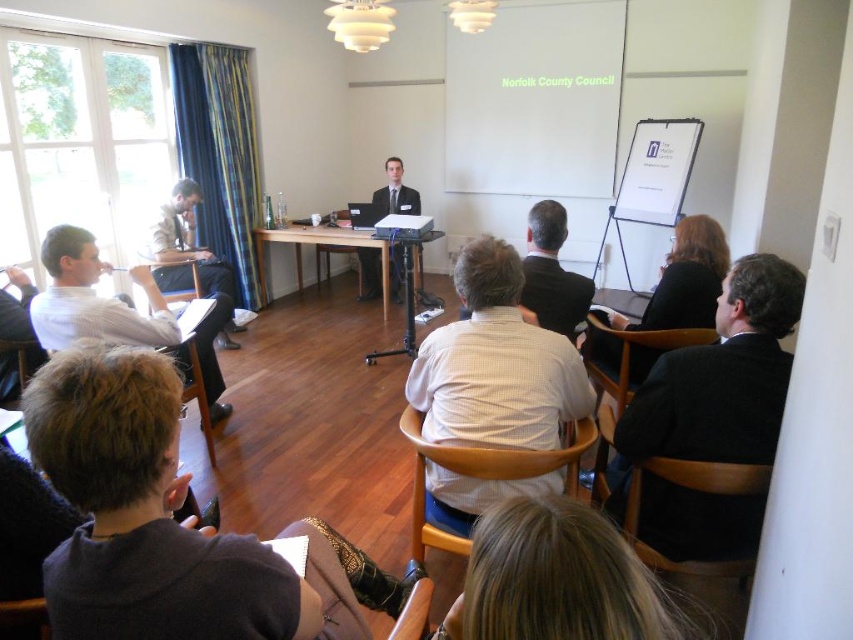
Question: Does white shirt at left have a greater width compared to light brown leather jacket at left?

Choices:
 (A) yes
 (B) no

Answer: (B)

Question: Is black suit at right to the right of light brown wood table at center from the viewer's perspective?

Choices:
 (A) yes
 (B) no

Answer: (A)

Question: Which point appears farthest from the camera in this image?

Choices:
 (A) (728, 401)
 (B) (376, 276)
 (C) (425, 234)
 (D) (57, 289)

Answer: (B)

Question: Which of the following is the closest to the observer?

Choices:
 (A) dark gray suit at center
 (B) white shirt at left

Answer: (A)

Question: Which object is closer to the camera taking this photo?

Choices:
 (A) dark suit at center
 (B) light brown leather jacket at left
 (C) black suit at right

Answer: (C)

Question: Does white checkered shirt at center have a greater width compared to dark suit at center?

Choices:
 (A) no
 (B) yes

Answer: (B)